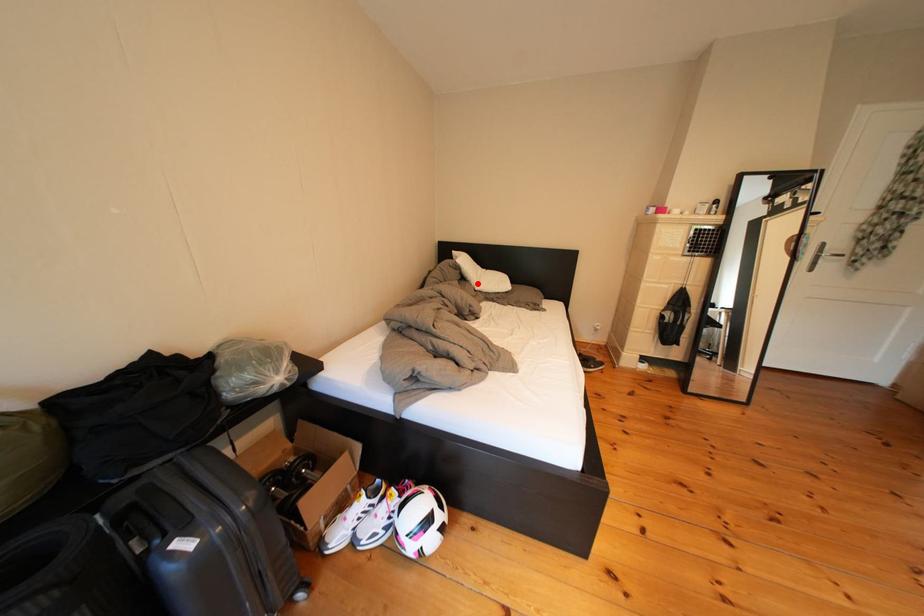
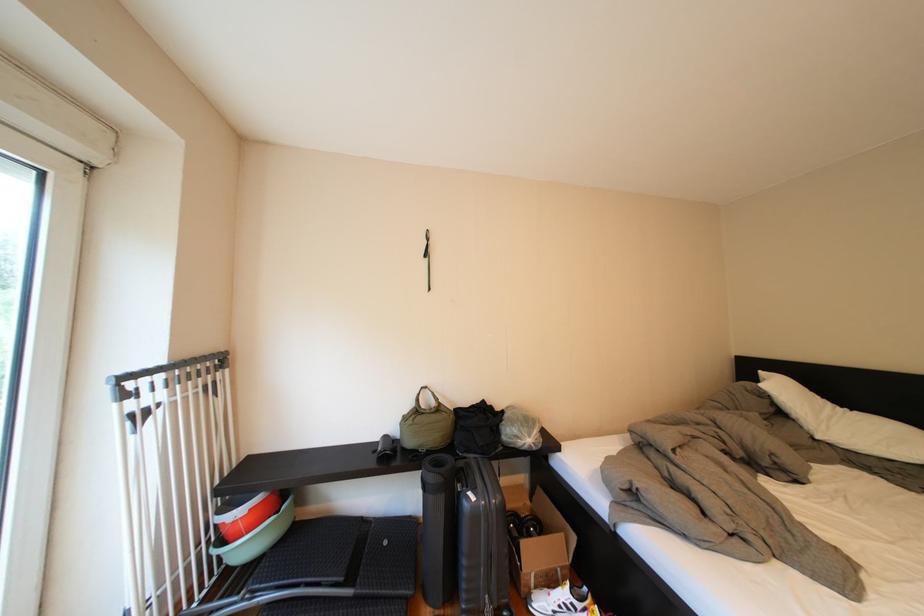
Find the pixel in the second image that matches the highlighted location in the first image.

(795, 419)